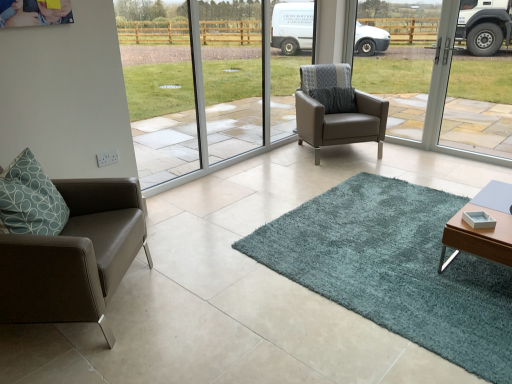
Question: From the image's perspective, would you say matte brown leather chair at left, which ranks as the 1th chair in left-to-right order, is shown under matte gray leather armchair at center, which is the 1th chair in top-to-bottom order?

Choices:
 (A) no
 (B) yes

Answer: (B)

Question: From a real-world perspective, is matte brown leather chair at left, placed as the first chair when sorted from bottom to top, over matte gray leather armchair at center, the 1th chair when ordered from back to front?

Choices:
 (A) yes
 (B) no

Answer: (B)

Question: Does matte brown leather chair at left, positioned as the second chair in back-to-front order, have a larger size compared to matte gray leather armchair at center, which ranks as the first chair in right-to-left order?

Choices:
 (A) yes
 (B) no

Answer: (B)

Question: Is matte brown leather chair at left, the 1th chair viewed from the front, at the left side of matte gray leather armchair at center, the 2th chair positioned from the bottom?

Choices:
 (A) no
 (B) yes

Answer: (B)

Question: From the image's perspective, is matte brown leather chair at left, positioned as the second chair in back-to-front order, above matte gray leather armchair at center, which is the 1th chair in top-to-bottom order?

Choices:
 (A) no
 (B) yes

Answer: (A)

Question: Is matte gray leather armchair at center, the 2th chair positioned from the bottom, taller or shorter than transparent glass window at center?

Choices:
 (A) short
 (B) tall

Answer: (A)

Question: Does point (361, 107) appear closer or farther from the camera than point (351, 3)?

Choices:
 (A) closer
 (B) farther

Answer: (A)

Question: Would you say matte gray leather armchair at center, which ranks as the first chair in right-to-left order, is to the left or to the right of transparent glass window at center in the picture?

Choices:
 (A) right
 (B) left

Answer: (A)

Question: Is matte gray leather armchair at center, which is the 1th chair in top-to-bottom order, in front of or behind transparent glass window at center in the image?

Choices:
 (A) behind
 (B) front

Answer: (A)

Question: Is teal shaggy rug at center inside or outside of wooden table at lower right?

Choices:
 (A) inside
 (B) outside

Answer: (B)

Question: Considering the positions of teal shaggy rug at center and wooden table at lower right in the image, is teal shaggy rug at center wider or thinner than wooden table at lower right?

Choices:
 (A) thin
 (B) wide

Answer: (B)

Question: Based on their positions, is teal shaggy rug at center located to the left or right of wooden table at lower right?

Choices:
 (A) right
 (B) left

Answer: (B)

Question: Is point (304, 205) positioned closer to the camera than point (440, 263)?

Choices:
 (A) closer
 (B) farther

Answer: (B)

Question: In terms of size, does teal shaggy rug at center appear bigger or smaller than matte brown leather chair at left, which ranks as the 1th chair in left-to-right order?

Choices:
 (A) small
 (B) big

Answer: (A)

Question: Is teal shaggy rug at center wider or thinner than matte brown leather chair at left, the 2th chair when ordered from top to bottom?

Choices:
 (A) thin
 (B) wide

Answer: (B)